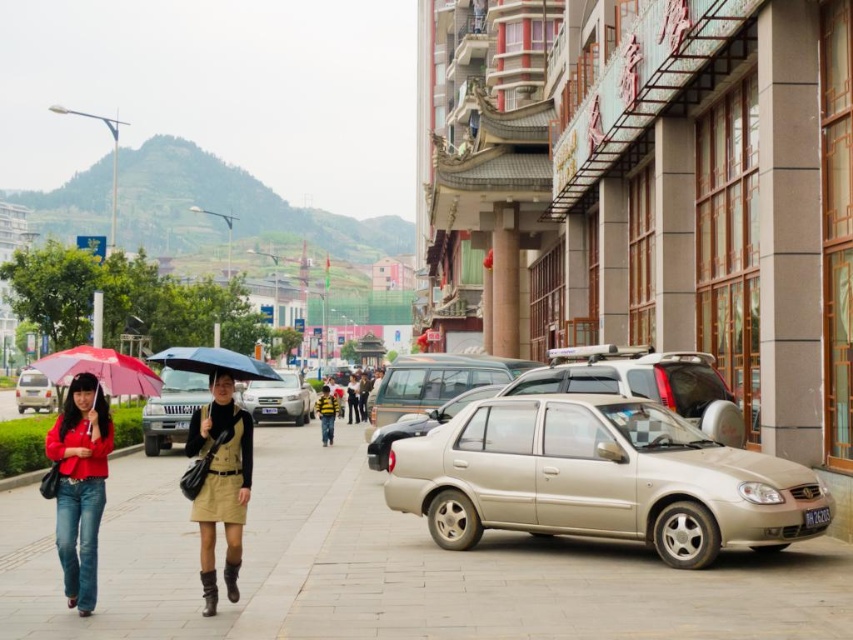
Question: Observing the image, what is the correct spatial positioning of matte red jacket at lower left in reference to matte khaki skirt at center?

Choices:
 (A) left
 (B) right

Answer: (A)

Question: Which of the following is the closest to the observer?

Choices:
 (A) satin gold car at center
 (B) matte silver sedan at left
 (C) smooth concrete sidewalk at center

Answer: (C)

Question: Is smooth concrete sidewalk at center thinner than yellow striped shirt at center?

Choices:
 (A) no
 (B) yes

Answer: (A)

Question: Which object appears farthest from the camera in this image?

Choices:
 (A) silver metallic sedan at center
 (B) matte red jacket at lower left

Answer: (A)

Question: Does metallic gold sedan at center have a lesser width compared to satin gold car at center?

Choices:
 (A) yes
 (B) no

Answer: (A)

Question: Among these objects, which one is nearest to the camera?

Choices:
 (A) metallic gold sedan at center
 (B) matte silver sedan at left

Answer: (A)